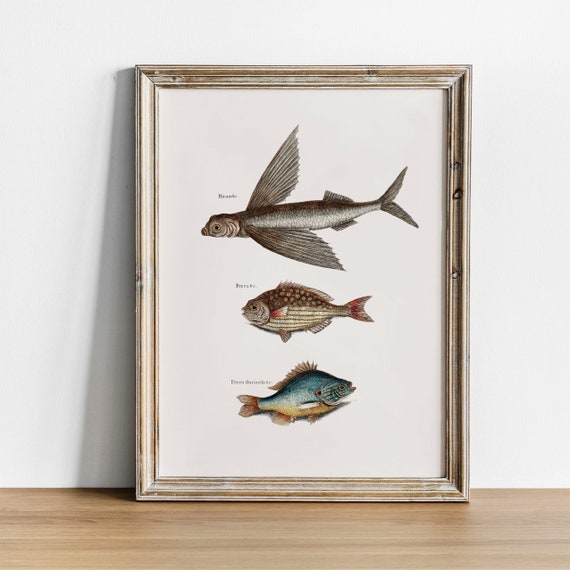
Locate an element on the screen. Image resolution: width=570 pixels, height=570 pixels. gold picture frame is located at coordinates (460, 160), (336, 492), (297, 79), (144, 377).